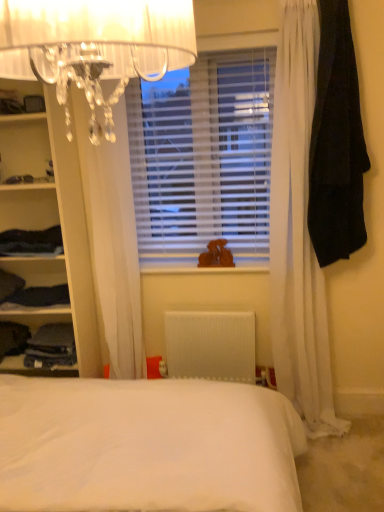
Question: Does dark blue fabric at left, acting as the 5th clothing starting from the left, turn towards white plastic radiator at center?

Choices:
 (A) no
 (B) yes

Answer: (A)

Question: Is dark blue fabric at left, acting as the 5th clothing starting from the left, outside white plastic radiator at center?

Choices:
 (A) yes
 (B) no

Answer: (A)

Question: Is dark blue fabric at left, the second clothing viewed from the right, positioned in front of white plastic radiator at center?

Choices:
 (A) yes
 (B) no

Answer: (A)

Question: From the image's perspective, is dark blue fabric at left, acting as the 5th clothing starting from the left, below white plastic radiator at center?

Choices:
 (A) yes
 (B) no

Answer: (B)

Question: Is dark blue fabric at left, acting as the 5th clothing starting from the left, shorter than white plastic radiator at center?

Choices:
 (A) yes
 (B) no

Answer: (A)

Question: Looking at the image, does dark blue fabric at left, the 3th clothing in the right-to-left sequence, seem bigger or smaller compared to dark blue fabric at left, which is counted as the 6th clothing, starting from the right?

Choices:
 (A) small
 (B) big

Answer: (A)

Question: Is dark blue fabric at left, the 3th clothing in the right-to-left sequence, situated inside dark blue fabric at left, positioned as the first clothing in left-to-right order, or outside?

Choices:
 (A) inside
 (B) outside

Answer: (B)

Question: Considering their positions, is dark blue fabric at left, which is counted as the 4th clothing, starting from the left, located in front of or behind dark blue fabric at left, which is counted as the 6th clothing, starting from the right?

Choices:
 (A) front
 (B) behind

Answer: (A)

Question: Visually, is dark blue fabric at left, which is counted as the 4th clothing, starting from the left, positioned to the left or to the right of dark blue fabric at left, which is counted as the 6th clothing, starting from the right?

Choices:
 (A) left
 (B) right

Answer: (B)

Question: Is translucent crystal chandelier at upper left wider or thinner than dark blue fabric at left, which is counted as the 6th clothing, starting from the right?

Choices:
 (A) wide
 (B) thin

Answer: (B)

Question: Is translucent crystal chandelier at upper left in front of or behind dark blue fabric at left, which is counted as the 6th clothing, starting from the right, in the image?

Choices:
 (A) front
 (B) behind

Answer: (A)

Question: Considering the positions of translucent crystal chandelier at upper left and dark blue fabric at left, which is counted as the 6th clothing, starting from the right, in the image, is translucent crystal chandelier at upper left taller or shorter than dark blue fabric at left, which is counted as the 6th clothing, starting from the right,?

Choices:
 (A) tall
 (B) short

Answer: (A)

Question: Do you think translucent crystal chandelier at upper left is within dark blue fabric at left, positioned as the first clothing in left-to-right order, or outside of it?

Choices:
 (A) inside
 (B) outside

Answer: (B)

Question: In the image, is denim pants at left, which is the fifth clothing from right to left, positioned in front of or behind black fabric at right, the 6th clothing in the left-to-right sequence?

Choices:
 (A) behind
 (B) front

Answer: (A)

Question: Based on their sizes in the image, would you say denim pants at left, which is the second clothing in left-to-right order, is bigger or smaller than black fabric at right, the 1th clothing in the right-to-left sequence?

Choices:
 (A) big
 (B) small

Answer: (B)